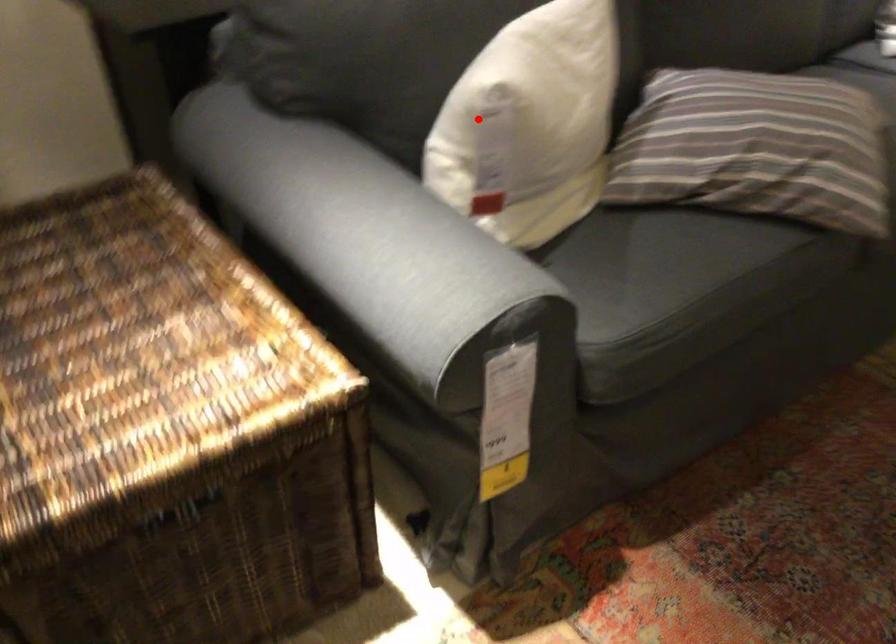
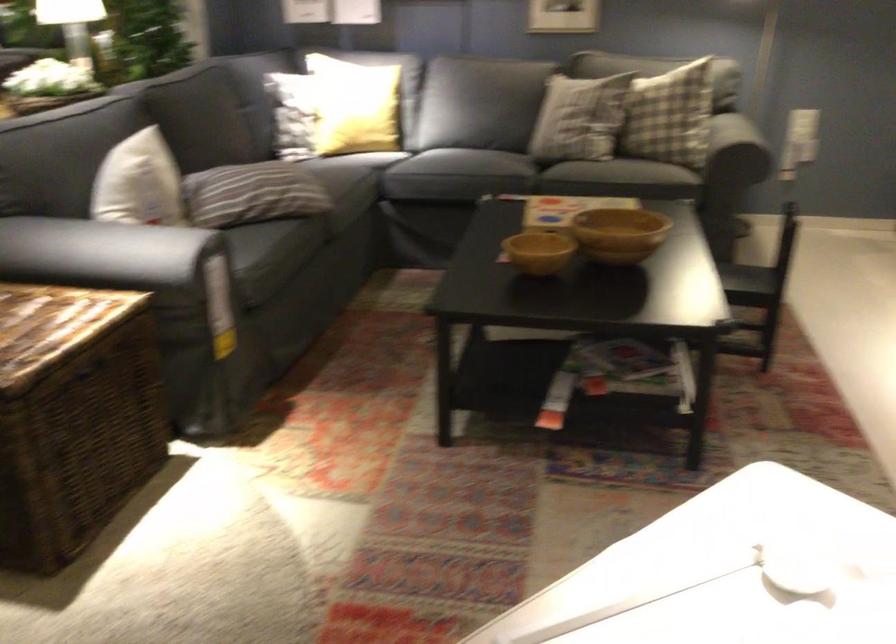
Question: I am providing you with two images of the same scene from different viewpoints. Given a red point in image1, look at the same physical point in image2. Is it:

Choices:
 (A) Closer to the viewpoint
 (B) Farther from the viewpoint

Answer: (B)